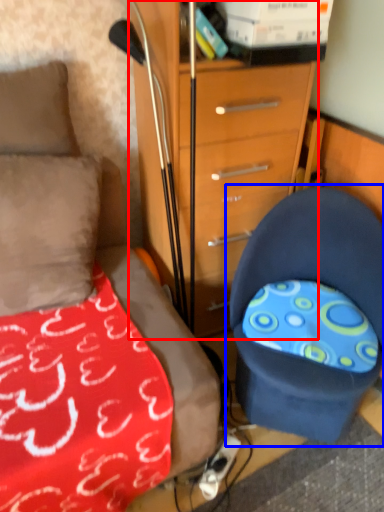
Question: Among these objects, which one is farthest to the camera, chest of drawers (highlighted by a red box) or chair (highlighted by a blue box)?

Choices:
 (A) chest of drawers
 (B) chair

Answer: (A)